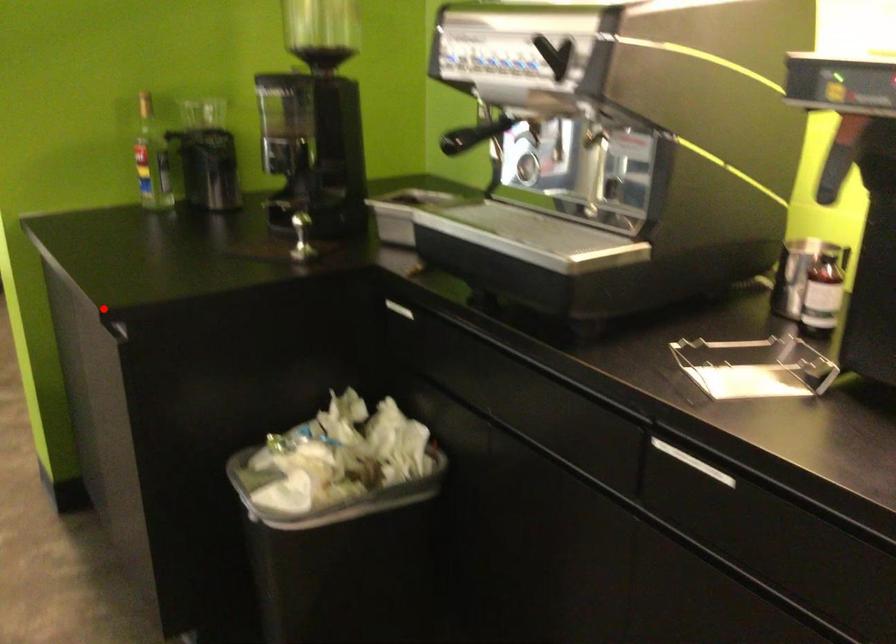
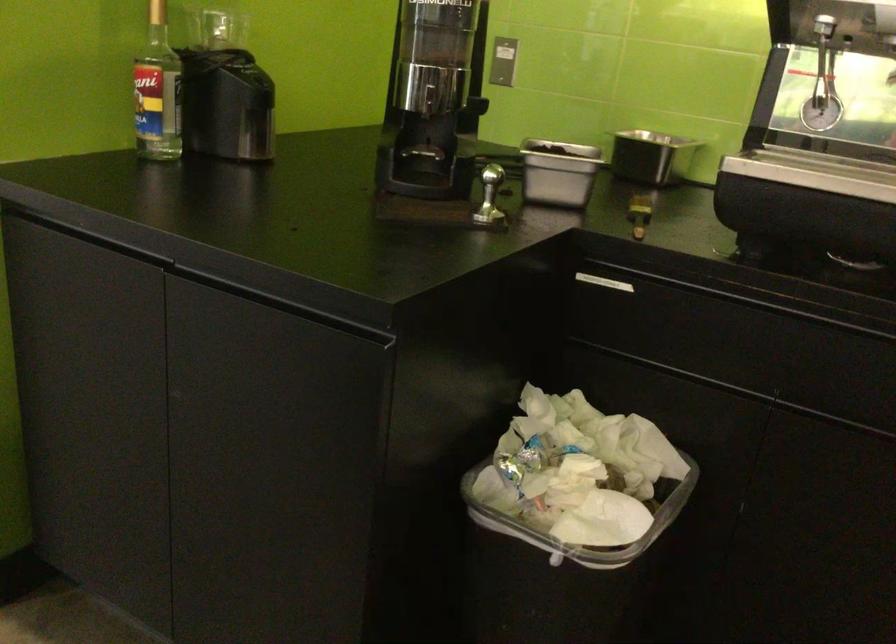
Question: I am providing you with two images of the same scene from different viewpoints. In image1, a red point is highlighted. Considering the same 3D point in image2, which of the following is correct?

Choices:
 (A) It is closer
 (B) It is farther

Answer: (A)